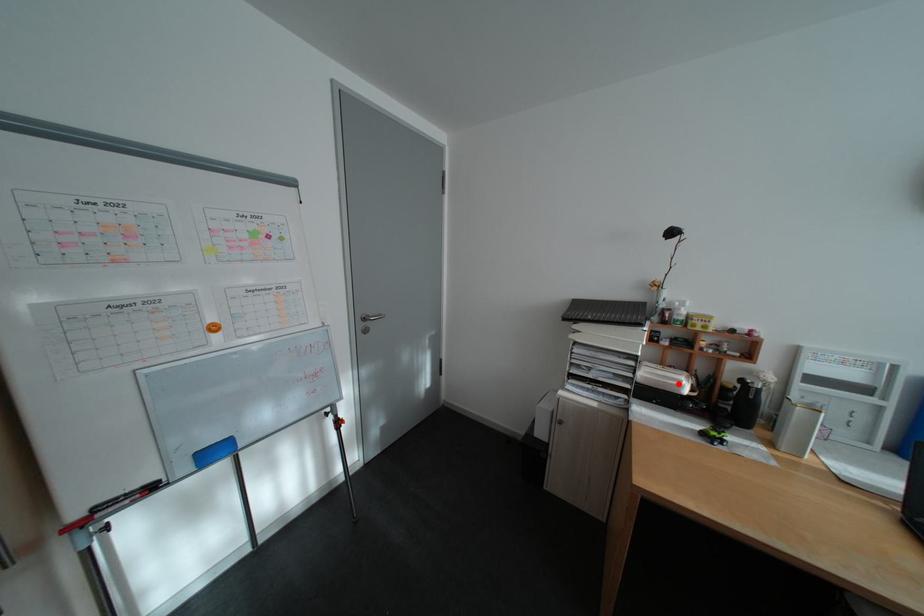
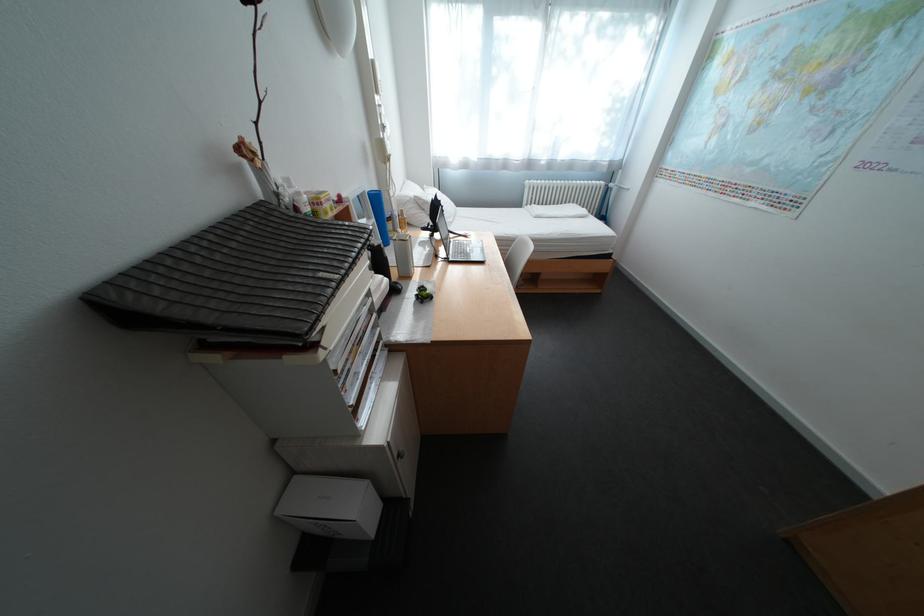
Find the pixel in the second image that matches the highlighted location in the first image.

(395, 292)